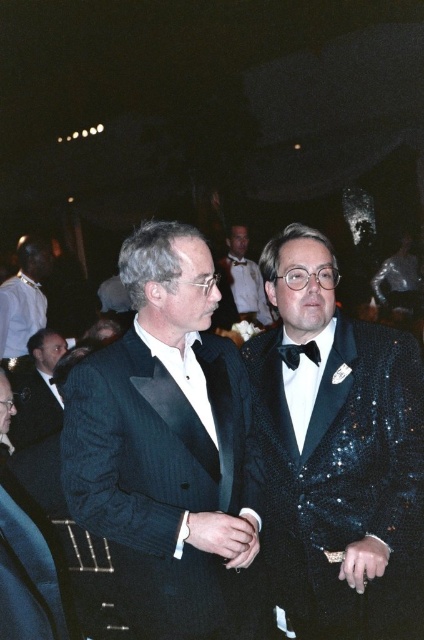
Question: Where is pinstriped fabric suit at center located in relation to shiny metallic suit at right in the image?

Choices:
 (A) above
 (B) below

Answer: (B)

Question: Can you confirm if sequined tuxedo at center is smaller than shiny black bow tie at center?

Choices:
 (A) yes
 (B) no

Answer: (A)

Question: Which object is positioned closest to the shiny metallic suit at right?

Choices:
 (A) black satin bow tie at center
 (B) black tuxedo at left
 (C) shiny black tuxedo at center

Answer: (B)

Question: Does black tuxedo at left have a larger size compared to black satin bow tie at center?

Choices:
 (A) no
 (B) yes

Answer: (B)

Question: Which of these objects is positioned farthest from the black tuxedo at left?

Choices:
 (A) white shirt at upper left
 (B) pinstriped fabric suit at center

Answer: (B)

Question: Which of the following is the farthest from the observer?

Choices:
 (A) (36, 284)
 (B) (290, 356)
 (C) (209, 499)
 (D) (251, 372)

Answer: (A)